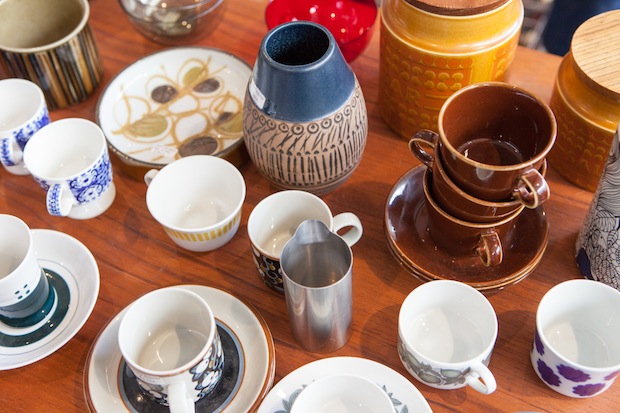
Image resolution: width=620 pixels, height=413 pixels. I want to click on plates, so click(80, 283), click(162, 119), click(371, 365), click(254, 346), click(270, 359), click(425, 253).